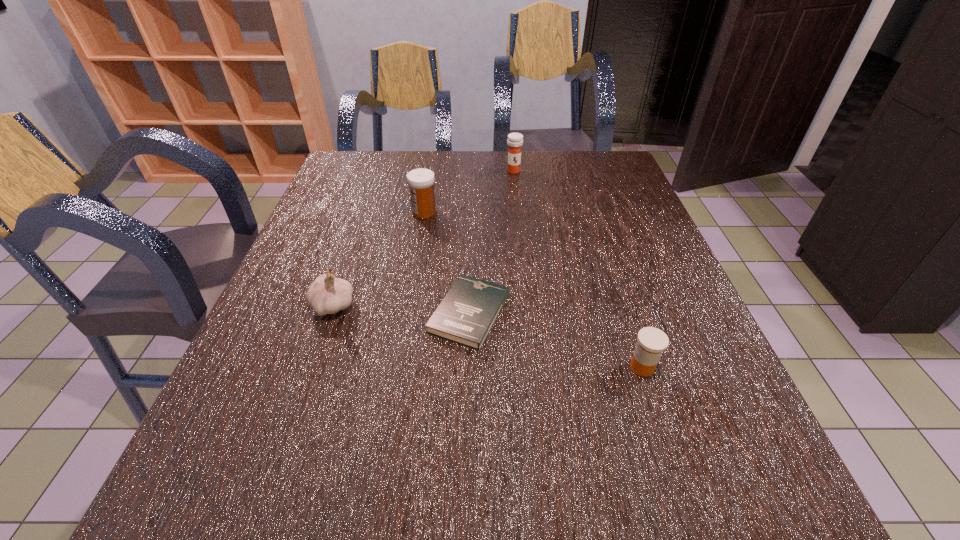
At what (x,y) coordinates should I click in order to perform the action: click on the second object from right to left. Please return your answer as a coordinate pair (x, y). Looking at the image, I should click on (515, 140).

This screenshot has height=540, width=960. Identify the location of the farthest medicine. point(515,140).

At what (x,y) coordinates should I click in order to perform the action: click on the second farthest medicine. Please return your answer as a coordinate pair (x, y). Image resolution: width=960 pixels, height=540 pixels. Looking at the image, I should click on (421, 181).

Find the location of a particular element. The width and height of the screenshot is (960, 540). the leftmost medicine is located at coordinates (421, 181).

Locate an element on the screen. The height and width of the screenshot is (540, 960). the leftmost object is located at coordinates (327, 295).

This screenshot has height=540, width=960. I want to click on the nearest object, so click(x=652, y=341).

Identify the location of the rightmost medicine. (652, 341).

Image resolution: width=960 pixels, height=540 pixels. In order to click on the shortest object in this screenshot , I will do `click(465, 316)`.

What are the coordinates of `the third object from right to left` in the screenshot? It's located at click(x=465, y=316).

This screenshot has width=960, height=540. I want to click on vacant space located on the label side of the farthest medicine, so pos(521,240).